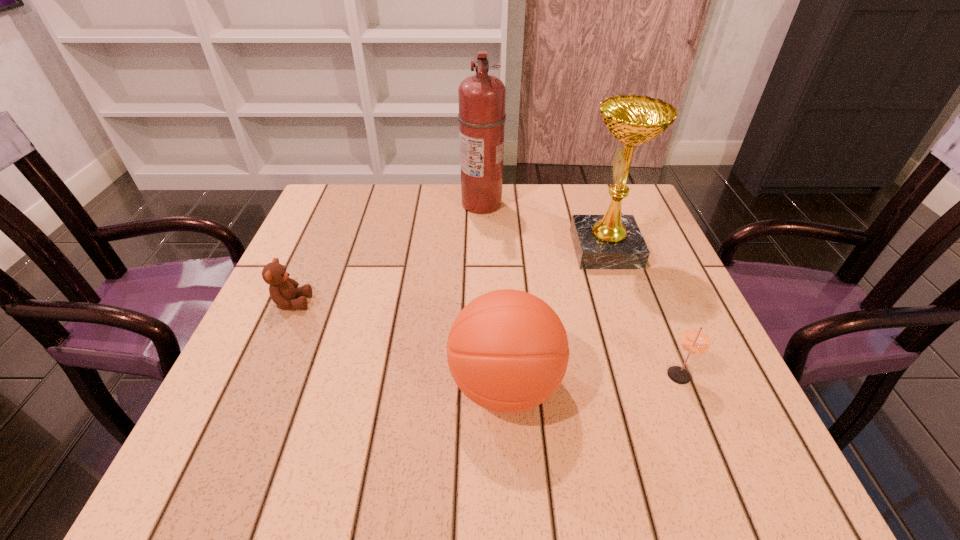
The image size is (960, 540). Identify the location of blank space at the near right corner of the desktop. (754, 461).

What are the coordinates of `unoccupied area between the teddy bear and the third tallest object` in the screenshot? It's located at pyautogui.click(x=398, y=343).

You are a GUI agent. You are given a task and a screenshot of the screen. Output one action in this format:
    pyautogui.click(x=<x>, y=<y>)
    Task: Click on the vacant area that lies between the second tallest object and the farthest object
    
    Given the screenshot: What is the action you would take?
    pyautogui.click(x=543, y=227)

Where is `vacant area between the basketball and the straw`? Image resolution: width=960 pixels, height=540 pixels. vacant area between the basketball and the straw is located at coordinates (592, 380).

The image size is (960, 540). Find the location of `vacant space that is in between the second tallest object and the teddy bear`. vacant space that is in between the second tallest object and the teddy bear is located at coordinates (448, 275).

Image resolution: width=960 pixels, height=540 pixels. What are the coordinates of `free space between the straw and the basketball` in the screenshot? It's located at (592, 380).

The image size is (960, 540). Find the location of `free spot between the second shortest object and the basketball`. free spot between the second shortest object and the basketball is located at coordinates (592, 380).

Where is `blank region between the farthest object and the straw`? This screenshot has height=540, width=960. blank region between the farthest object and the straw is located at coordinates (581, 290).

At what (x,y) coordinates should I click in order to perform the action: click on object that is the fourth closest one to the straw. Please return your answer as a coordinate pair (x, y). This screenshot has height=540, width=960. Looking at the image, I should click on (283, 290).

I want to click on object that is the closest to the leftmost object, so click(x=507, y=350).